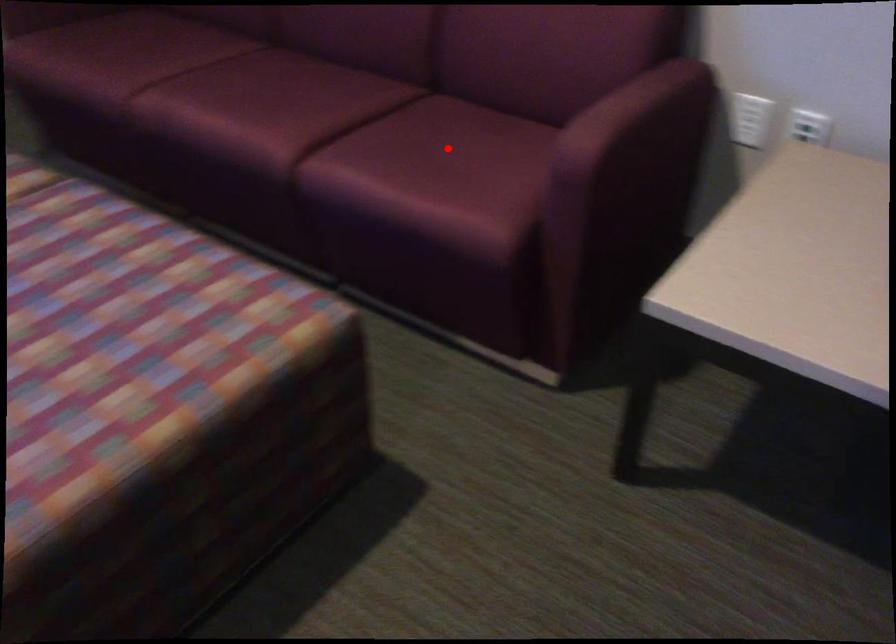
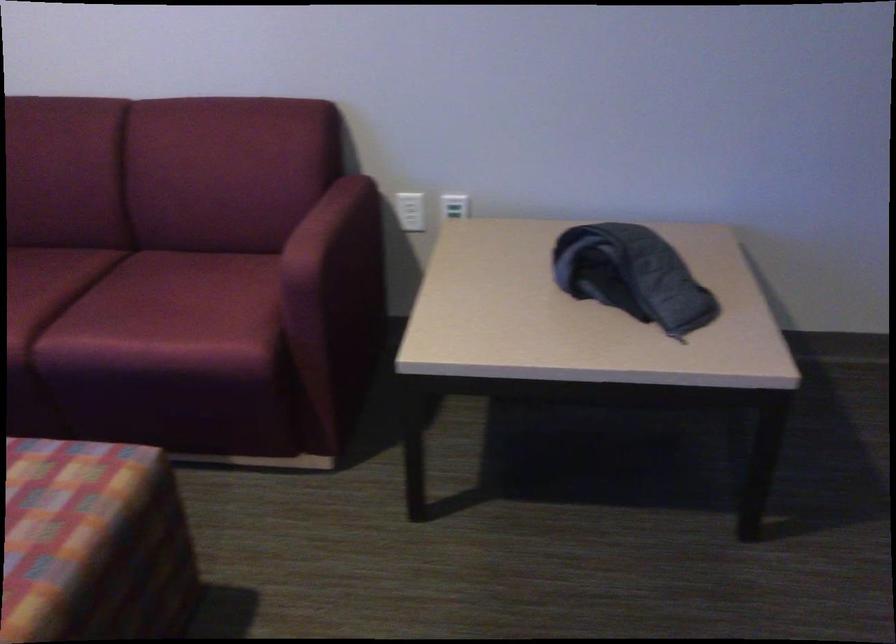
Where in the second image is the point corresponding to the highlighted location from the first image?

(175, 290)